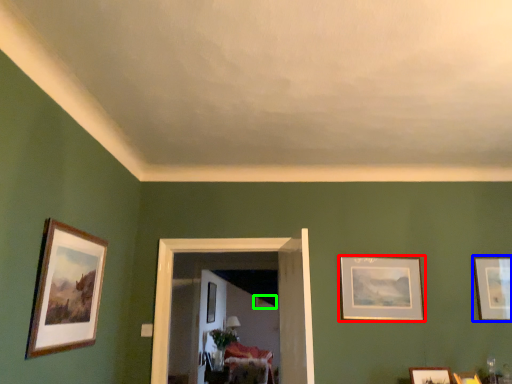
Question: Based on their relative distances, which object is farther from picture frame (highlighted by a red box)? Choose from picture frame (highlighted by a blue box) and picture frame (highlighted by a green box).

Choices:
 (A) picture frame
 (B) picture frame

Answer: (B)